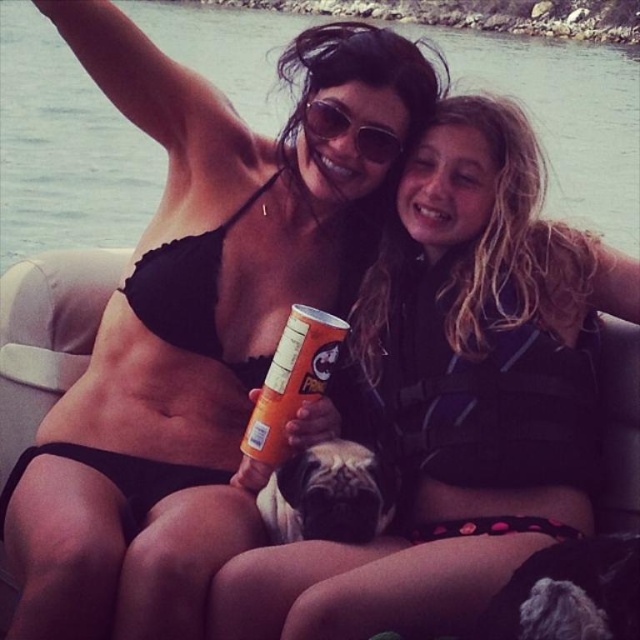
Does black bikini at center appear over pug fur at center?

Yes, black bikini at center is above pug fur at center.

Locate an element on the screen. Image resolution: width=640 pixels, height=640 pixels. black bikini at center is located at coordinates (195, 324).

Where is `black bikini at center`? This screenshot has width=640, height=640. black bikini at center is located at coordinates (195, 324).

Can you confirm if fluffy gray dog at lower right is smaller than sunglasses at center?

No, fluffy gray dog at lower right is not smaller than sunglasses at center.

Is fluffy gray dog at lower right below sunglasses at center?

Yes.

Image resolution: width=640 pixels, height=640 pixels. I want to click on fluffy gray dog at lower right, so click(x=570, y=593).

Which is in front, point (330, 477) or point (353, 132)?

Point (330, 477) is more forward.

Measure the distance between point (273,525) and camera.

Point (273,525) is 9.51 meters from camera.

Find the location of a particular element. The image size is (640, 640). pug fur at center is located at coordinates (330, 493).